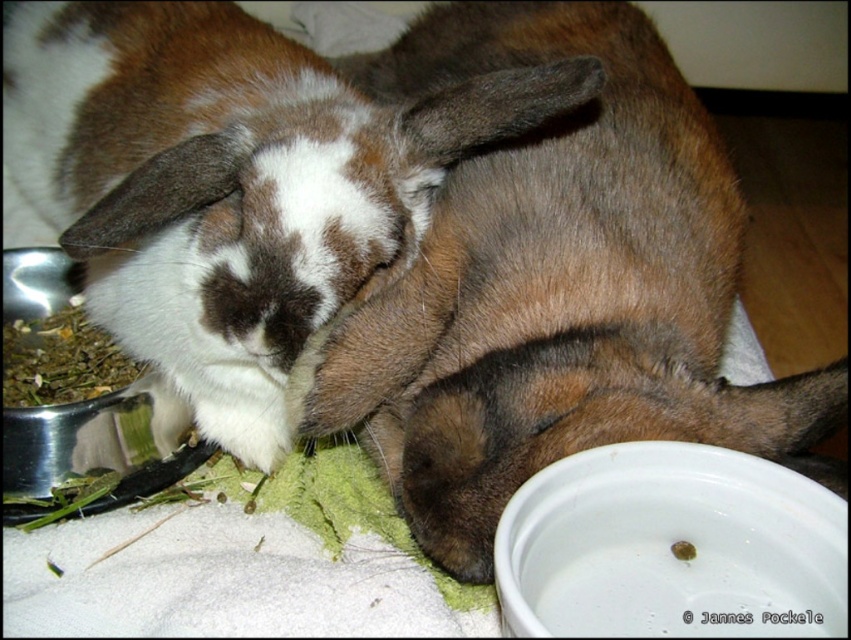
You are a pet owner who wants to ensure your rabbits have easy access to their water bowl. Based on the scene, can the brown and white fur rabbit at center reach the metallic silver bowl at lower left without moving from its current position?

The brown and white fur rabbit at center is above the metallic silver bowl at lower left, so it can easily reach the bowl without needing to move from its current position.

Looking at this image, you are a pet owner who wants to ensure your rabbits have easy access to their water bowl. Based on the scene, can the brown fur rabbit at center reach the white glossy bowl at lower right without moving from its current position?

The brown fur rabbit at center is above the white glossy bowl at lower right, so it can easily reach the bowl without needing to move from its current position.